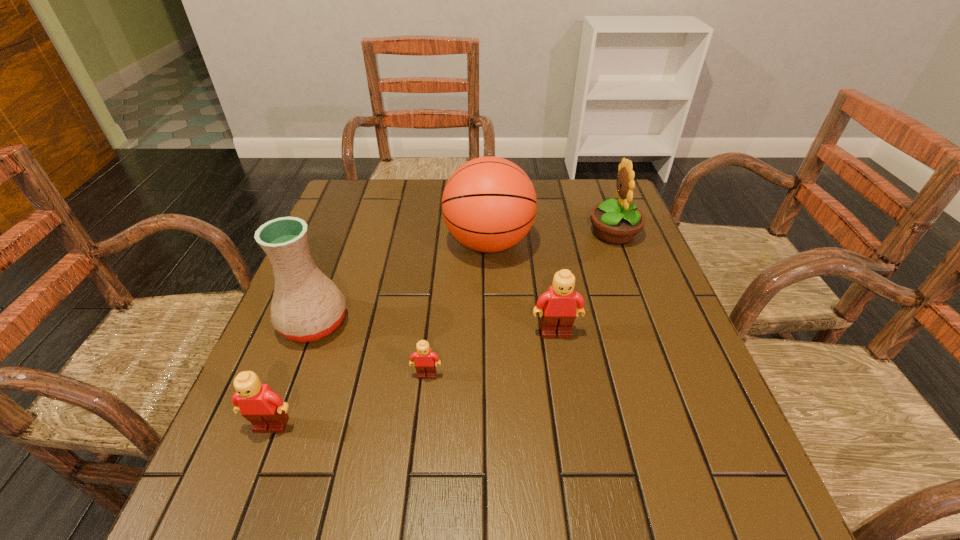
Where is `object located at the right edge`? object located at the right edge is located at coordinates (615, 222).

What are the coordinates of `object that is at the near left corner` in the screenshot? It's located at (265, 409).

At what (x,y) coordinates should I click in order to perform the action: click on object that is at the far right corner. Please return your answer as a coordinate pair (x, y). The height and width of the screenshot is (540, 960). Looking at the image, I should click on (615, 222).

You are a GUI agent. You are given a task and a screenshot of the screen. Output one action in this format:
    pyautogui.click(x=<x>, y=<y>)
    Task: Click on the vacant space at the near edge of the desktop
    The width and height of the screenshot is (960, 540).
    Given the screenshot: What is the action you would take?
    pyautogui.click(x=457, y=421)

The width and height of the screenshot is (960, 540). I want to click on free space at the left edge of the desktop, so click(x=338, y=229).

At what (x,y) coordinates should I click in order to perform the action: click on blank area at the right edge. Please return your answer as a coordinate pair (x, y). This screenshot has height=540, width=960. Looking at the image, I should click on (600, 295).

Find the location of `vacant point at the far left corner`. vacant point at the far left corner is located at coordinates (368, 206).

I want to click on vacant region at the far right corner, so click(x=591, y=190).

This screenshot has height=540, width=960. In order to click on free space at the near right corner in this screenshot , I will do tap(700, 438).

The image size is (960, 540). Find the location of `free space between the rightmost object and the pottery`. free space between the rightmost object and the pottery is located at coordinates (464, 278).